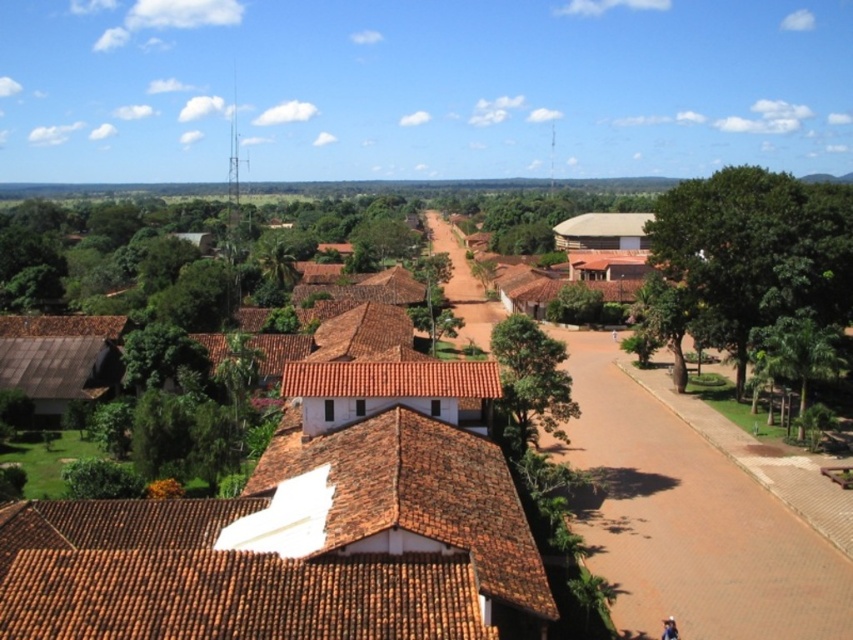
Can you confirm if green leafy tree at right is shorter than green leafy tree at center?

Incorrect, green leafy tree at right's height does not fall short of green leafy tree at center's.

Is point (809, 278) closer to viewer compared to point (544, 387)?

That is False.

Is point (802, 186) more distant than point (535, 374)?

Yes, it is behind point (535, 374).

What are the coordinates of `green leafy tree at right` in the screenshot? It's located at (753, 253).

Does green leafy tree at right come in front of green leafy tree at lower right?

That is False.

Locate an element on the screen. The image size is (853, 640). green leafy tree at right is located at coordinates (753, 253).

Is brown tile roof at center above green leafy tree at center?

Answer: No, brown tile roof at center is not above green leafy tree at center.

Who is more forward, (503,628) or (547,428)?

Point (503,628)

The width and height of the screenshot is (853, 640). What do you see at coordinates (305, 529) in the screenshot?
I see `brown tile roof at center` at bounding box center [305, 529].

You are a GUI agent. You are given a task and a screenshot of the screen. Output one action in this format:
    pyautogui.click(x=<x>, y=<y>)
    Task: Click on the brown tile roof at center
    This screenshot has width=853, height=640.
    Given the screenshot: What is the action you would take?
    pyautogui.click(x=305, y=529)